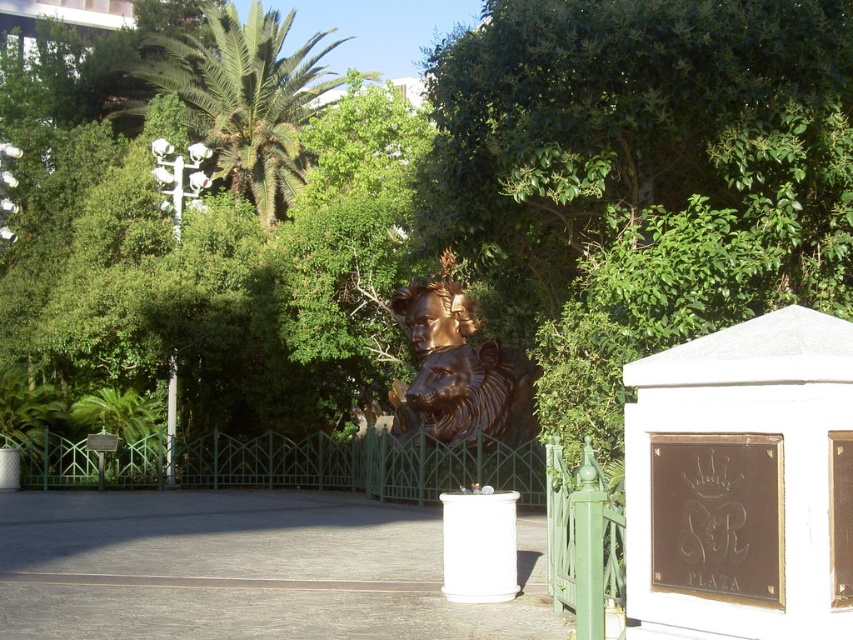
Who is taller, green metal fence at center or bronze/smooth lion head at center?

bronze/smooth lion head at center

Can you confirm if green metal fence at center is bigger than bronze/smooth lion head at center?

Correct, green metal fence at center is larger in size than bronze/smooth lion head at center.

Locate an element on the screen. The image size is (853, 640). green metal fence at center is located at coordinates (363, 465).

The height and width of the screenshot is (640, 853). In order to click on green metal fence at center in this screenshot , I will do `click(363, 465)`.

Between point (433, 442) and point (289, 177), which one is positioned in front?

Point (433, 442)

Image resolution: width=853 pixels, height=640 pixels. Find the location of `green metal fence at center`. green metal fence at center is located at coordinates (363, 465).

Can you confirm if green leafy palm tree at upper left is smaller than bronze/smooth lion head at center?

Actually, green leafy palm tree at upper left might be larger than bronze/smooth lion head at center.

Who is more forward, (315,80) or (453,392)?

Positioned in front is point (453,392).

Locate an element on the screen. The image size is (853, 640). green leafy palm tree at upper left is located at coordinates (245, 97).